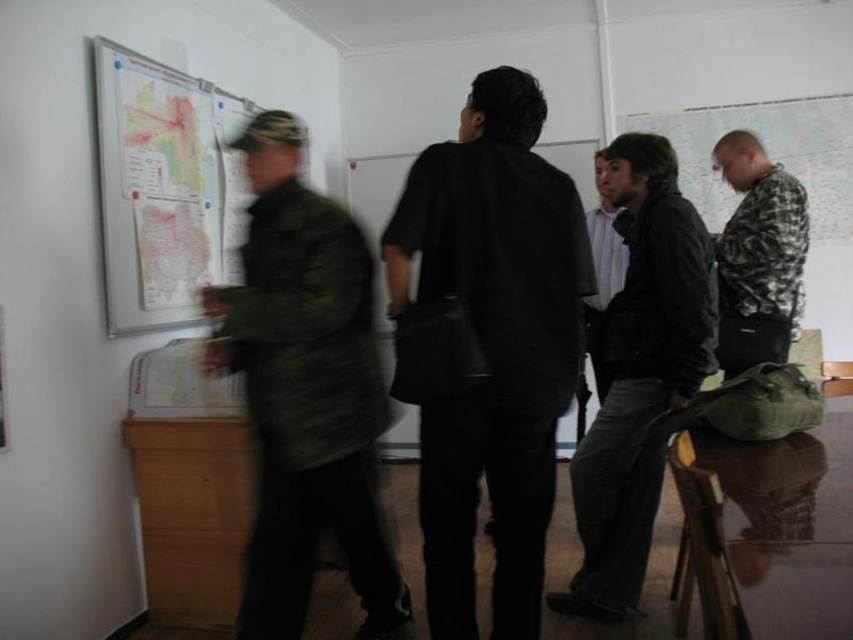
Question: Which of these objects is positioned closest to the camouflage jacket at left?

Choices:
 (A) map paper at upper left
 (B) black matte bag at center
 (C) matte black jacket at center

Answer: (B)

Question: Which point is closer to the camera?

Choices:
 (A) map paper at upper left
 (B) matte black jacket at center

Answer: (A)

Question: Estimate the real-world distances between objects in this image. Which object is farther from the camouflage jacket at right?

Choices:
 (A) camouflage jacket at left
 (B) map paper at upper left
 (C) black leather jacket at center
 (D) matte black jacket at center

Answer: (B)

Question: Is camouflage jacket at right above matte black jacket at center?

Choices:
 (A) no
 (B) yes

Answer: (A)

Question: Can you confirm if camouflage jacket at left is positioned to the left of camouflage jacket at right?

Choices:
 (A) no
 (B) yes

Answer: (B)

Question: Does map paper at upper left have a smaller size compared to matte black jacket at center?

Choices:
 (A) yes
 (B) no

Answer: (B)